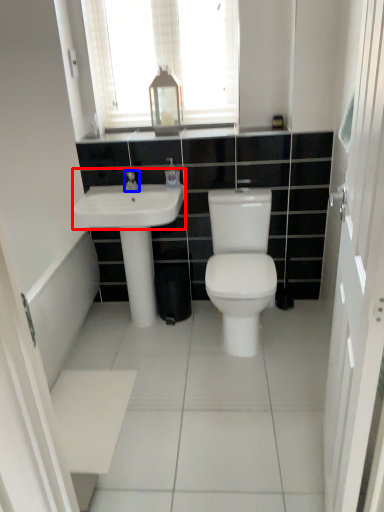
Question: Which of the following is the closest to the observer, sink (highlighted by a red box) or tap (highlighted by a blue box)?

Choices:
 (A) sink
 (B) tap

Answer: (A)